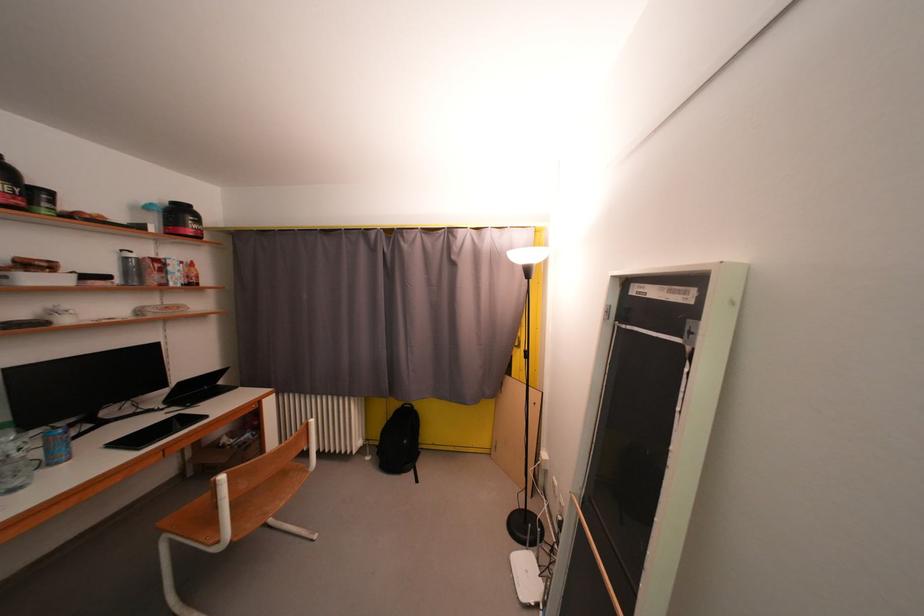
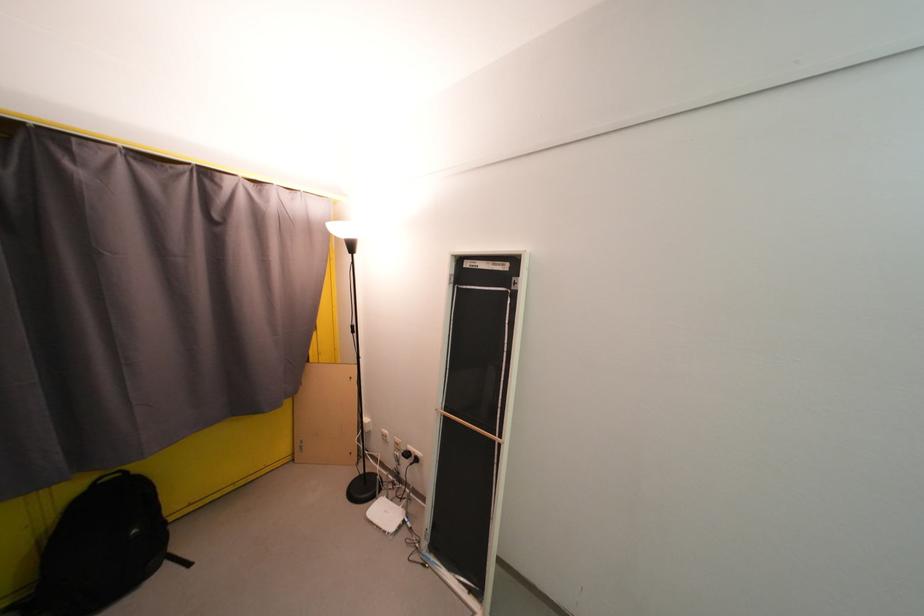
Locate, in the second image, the point that corresponds to (533,573) in the first image.

(392, 515)